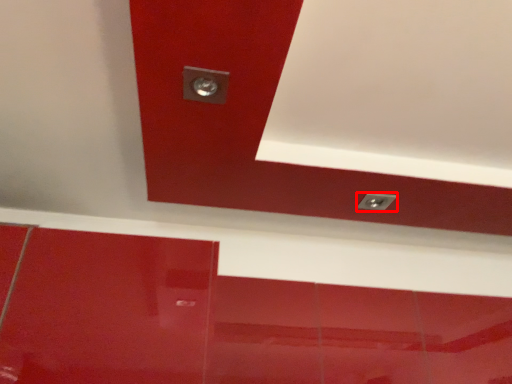
Question: From the image's perspective, where is knob (annotated by the red box) located in relation to exhaust hood in the image?

Choices:
 (A) above
 (B) below

Answer: (B)